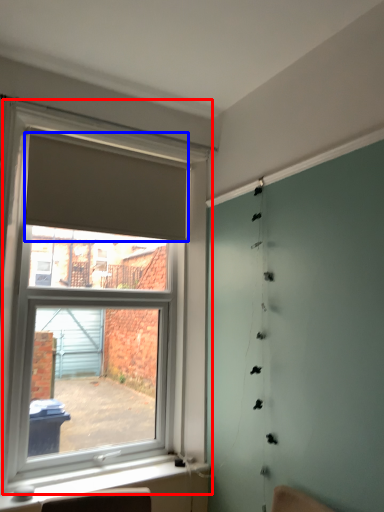
Question: Which object appears farthest to the camera in this image, window (highlighted by a red box) or curtain (highlighted by a blue box)?

Choices:
 (A) window
 (B) curtain

Answer: (B)